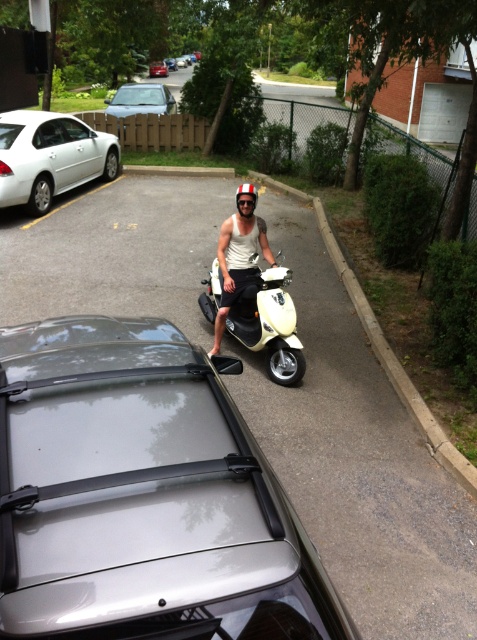
You are a delivery person who needs to choose a helmet for a scooter ride. You have two helmets available in the scene. Which helmet has a wider width, the shiny silver helmet at center or the red matte helmet at center?

The shiny silver helmet at center has a larger width than the red matte helmet at center according to the description.

You are a delivery person who needs to pick up a package from the silver metallic sedan at upper left. You are currently standing next to the shiny silver helmet at center. Which direction should you move to reach the sedan?

The shiny silver helmet at center is behind silver metallic sedan at upper left, so you should move forward towards the front of the silver metallic sedan at upper left to reach it.

You are standing at the point marked by the coordinates point (50, 156). You want to walk to the silver car with a roof rack in the foreground. Which direction should you head towards?

The silver car with a roof rack is in the foreground, so you should head towards the front direction from point (50, 156).